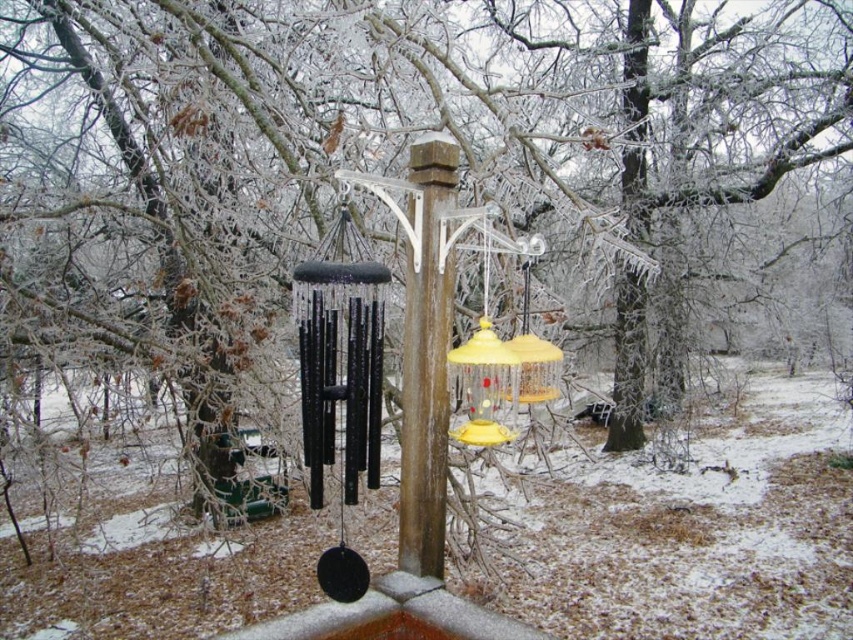
Does black metallic wind chime at center appear on the right side of brown wood post at center?

No, black metallic wind chime at center is not to the right of brown wood post at center.

Is point (337, 573) positioned behind point (424, 524)?

No, (337, 573) is in front of (424, 524).

Find the location of a particular element. black metallic wind chime at center is located at coordinates (340, 381).